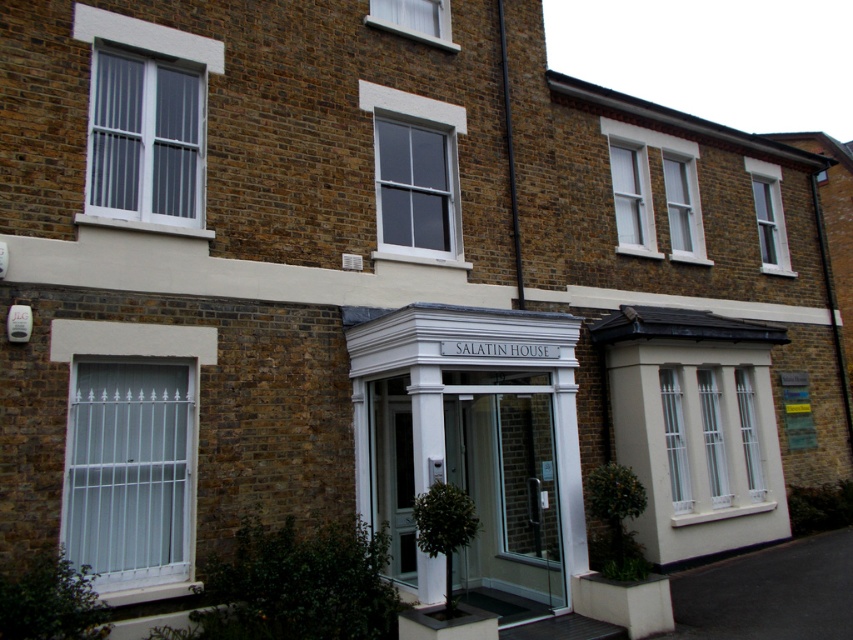
Can you confirm if transparent glass door at center is thinner than white glossy pillar at center?

No.

Can you confirm if transparent glass door at center is positioned below white glossy pillar at center?

Yes.

Measure the distance between transparent glass door at center and camera.

transparent glass door at center is 7.18 meters from camera.

At what (x,y) coordinates should I click in order to perform the action: click on transparent glass door at center. Please return your answer as a coordinate pair (x, y). The width and height of the screenshot is (853, 640). Looking at the image, I should click on (506, 490).